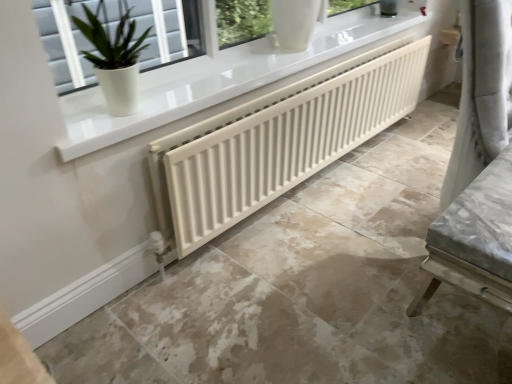
Question: From the image's perspective, is white matte radiator at center on top of white glossy pot at upper left?

Choices:
 (A) yes
 (B) no

Answer: (B)

Question: From a real-world perspective, is white matte radiator at center located higher than white glossy pot at upper left?

Choices:
 (A) no
 (B) yes

Answer: (A)

Question: Is white matte radiator at center far away from white glossy pot at upper left?

Choices:
 (A) no
 (B) yes

Answer: (B)

Question: Does white matte radiator at center appear on the left side of white glossy pot at upper left?

Choices:
 (A) yes
 (B) no

Answer: (B)

Question: Considering the relative sizes of white matte radiator at center and white glossy pot at upper left in the image provided, is white matte radiator at center bigger than white glossy pot at upper left?

Choices:
 (A) no
 (B) yes

Answer: (B)

Question: In terms of size, does white matte radiator at center appear bigger or smaller than white matte radiator at center?

Choices:
 (A) small
 (B) big

Answer: (A)

Question: From a real-world perspective, relative to white matte radiator at center, is white matte radiator at center vertically above or below?

Choices:
 (A) below
 (B) above

Answer: (B)

Question: Looking at their shapes, would you say white matte radiator at center is wider or thinner than white matte radiator at center?

Choices:
 (A) wide
 (B) thin

Answer: (B)

Question: In terms of height, does white matte radiator at center look taller or shorter compared to white matte radiator at center?

Choices:
 (A) tall
 (B) short

Answer: (A)

Question: From a real-world perspective, is white glossy pot at upper left above or below white matte radiator at center?

Choices:
 (A) below
 (B) above

Answer: (B)

Question: Looking at the image, does white glossy pot at upper left seem bigger or smaller compared to white matte radiator at center?

Choices:
 (A) small
 (B) big

Answer: (A)

Question: Choose the correct answer: Is white glossy pot at upper left inside white matte radiator at center or outside it?

Choices:
 (A) outside
 (B) inside

Answer: (A)

Question: Considering the positions of white glossy pot at upper left and white matte radiator at center in the image, is white glossy pot at upper left taller or shorter than white matte radiator at center?

Choices:
 (A) short
 (B) tall

Answer: (B)

Question: Considering the positions of white matte radiator at center and white matte radiator at center in the image, is white matte radiator at center taller or shorter than white matte radiator at center?

Choices:
 (A) short
 (B) tall

Answer: (A)

Question: From the image's perspective, is white matte radiator at center located above or below white matte radiator at center?

Choices:
 (A) below
 (B) above

Answer: (A)